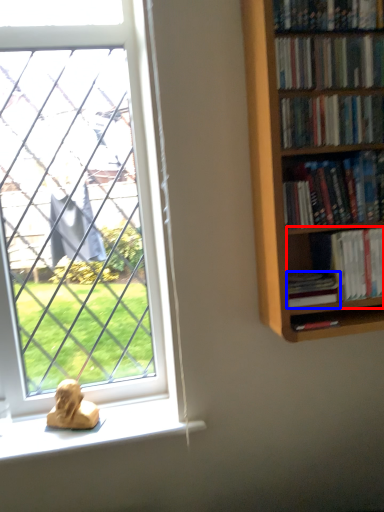
Question: Which point is further to the camera, book (highlighted by a red box) or book (highlighted by a blue box)?

Choices:
 (A) book
 (B) book

Answer: (A)